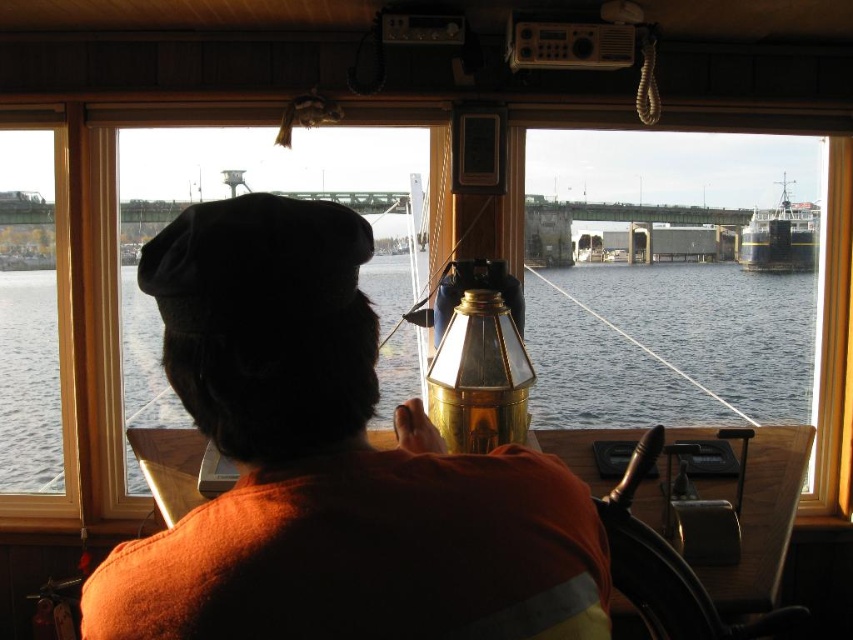
You are standing inside the boat cabin and want to reach both points mentioned. Which point is closer to you, point (x=260, y=372) or point (x=54, y=401)?

Point (x=260, y=372) is closer to the viewer than point (x=54, y=401).

You are an observer standing outside the boat cabin. You see the orange fabric shirt at center and the dark blue metallic boat at upper right. Which object is closer to the front of the boat?

The orange fabric shirt at center is positioned under the dark blue metallic boat at upper right, meaning it is closer to the front of the boat.